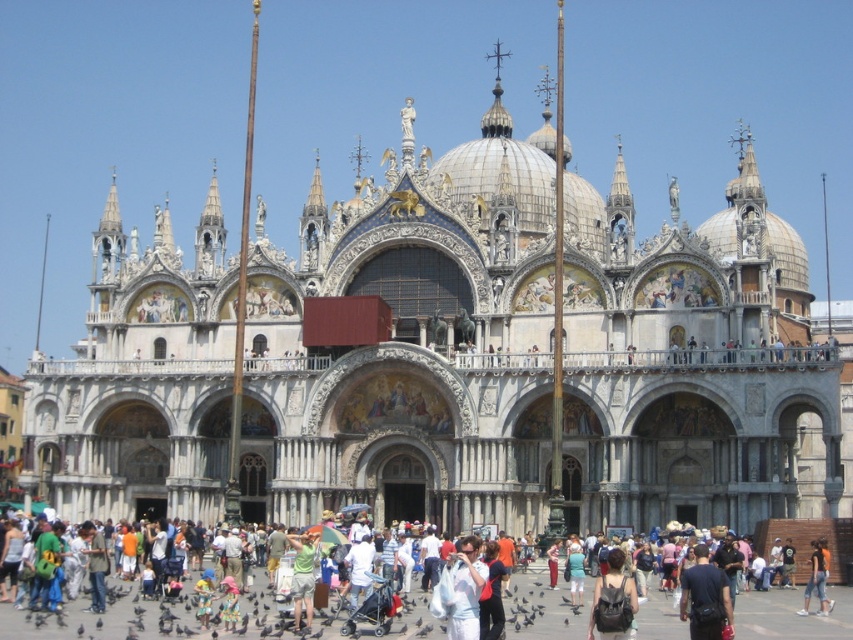
Looking at this image, you are a tourist standing in the square in front of the Basilica di San Marco. You see a person wearing a white cotton shirt at center and another wearing denim shorts at lower right. If you want to take a photo of both people without any obstructions, which direction should you move to ensure both are in frame?

You should move to the left side because the white cotton shirt at center is to the left of denim shorts at lower right, so positioning yourself to the left will keep both in the frame without one blocking the other.

You are a tour guide standing in front of the Basilica di San Marco. You notice two tourists wearing a white cotton shirt at center and a green cotton shirt at center. From your perspective, which tourist is standing closer to the basilica?

The white cotton shirt at center is located above the green cotton shirt at center, which means the white cotton shirt at center is closer to the basilica.